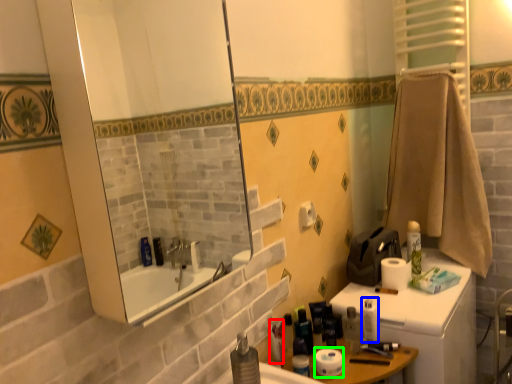
Question: Which object is the closest to the toiletry (highlighted by a red box)? Choose among these: toiletry (highlighted by a blue box) or toilet paper (highlighted by a green box).

Choices:
 (A) toiletry
 (B) toilet paper

Answer: (B)